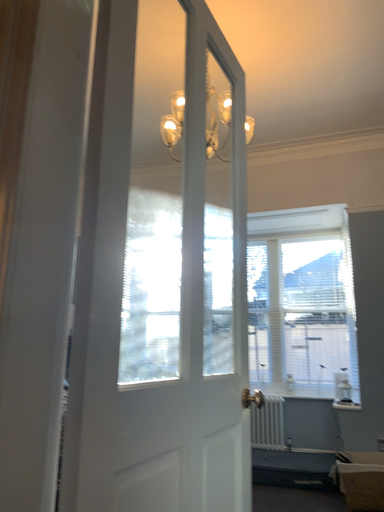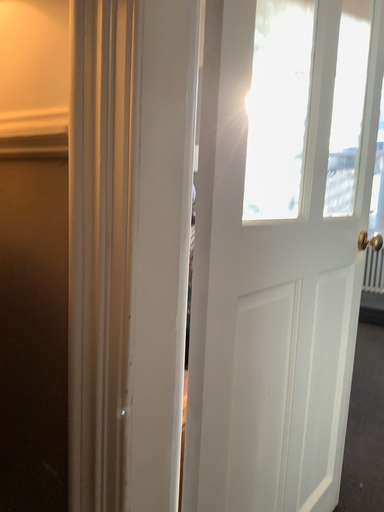
Question: Which way did the camera rotate in the video?

Choices:
 (A) rotated upward
 (B) rotated downward

Answer: (B)